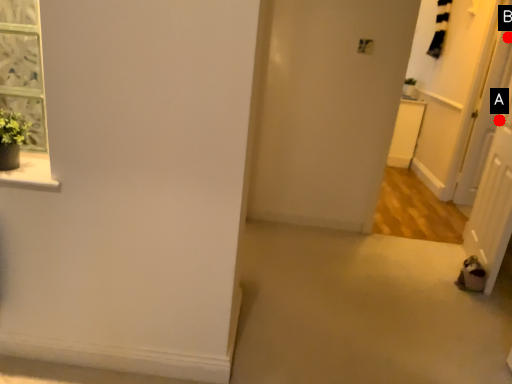
Question: Two points are circled on the image, labeled by A and B beside each circle. Which point is farther from the camera taking this photo?

Choices:
 (A) A is further
 (B) B is further

Answer: (A)